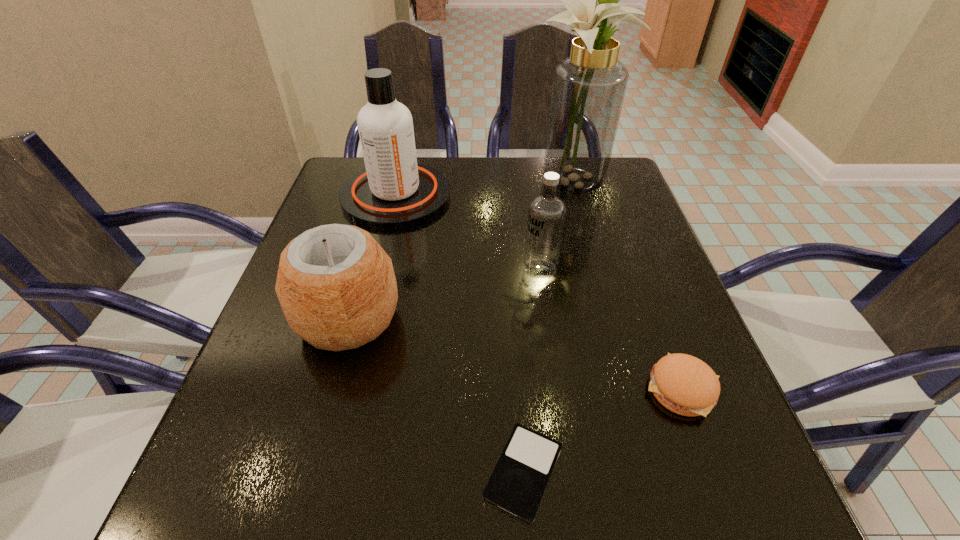
Locate an element on the screen. flower arrangement is located at coordinates (588, 89).

Image resolution: width=960 pixels, height=540 pixels. In order to click on cleansing agent in this screenshot , I will do `click(394, 191)`.

Find the location of a particular element. coconut is located at coordinates (336, 285).

This screenshot has width=960, height=540. Identify the location of the third farthest object. (547, 212).

Image resolution: width=960 pixels, height=540 pixels. What are the coordinates of `the second shortest object` in the screenshot? It's located at (684, 384).

Locate an element on the screen. the shortest object is located at coordinates (517, 484).

Where is `iPod`? iPod is located at coordinates (517, 484).

Find the location of a particular element. blank space located on the left of the tallest object is located at coordinates (397, 183).

Locate an element on the screen. This screenshot has height=540, width=960. vacant space located 0.120m on the right of the cleansing agent is located at coordinates (496, 195).

Where is `free space located 0.360m on the right of the coconut`? The image size is (960, 540). free space located 0.360m on the right of the coconut is located at coordinates (589, 319).